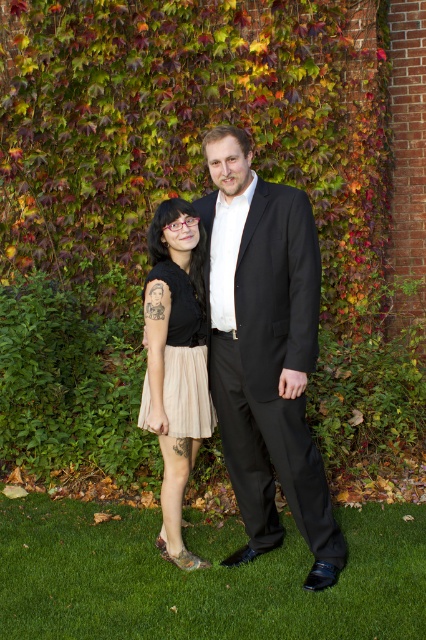
You are a photographer setting up a shoot in front of the ivy wall. You need to ensure that the black smooth suit at center and the beige pleated skirt at lower left are both visible in the frame. Based on their positions, which item should you focus on first to ensure depth of field captures both?

The black smooth suit at center is closer to the viewer than the beige pleated skirt at lower left. To ensure both are in focus, focus on the black smooth suit at center first, as it is closer, and the depth of field will extend to the farther object.